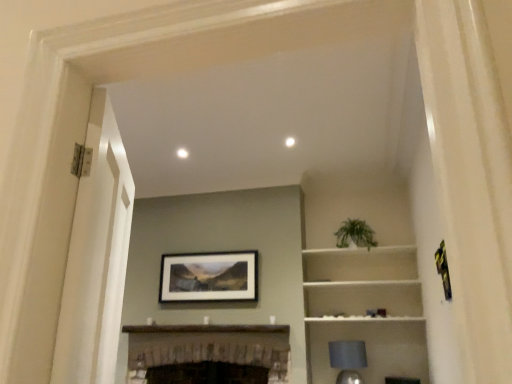
Question: Is white matte cabinet at upper right not within dark brown wood fireplace at center?

Choices:
 (A) yes
 (B) no

Answer: (A)

Question: Can you confirm if white matte cabinet at upper right is shorter than dark brown wood fireplace at center?

Choices:
 (A) no
 (B) yes

Answer: (A)

Question: From a real-world perspective, is white matte cabinet at upper right positioned under dark brown wood fireplace at center based on gravity?

Choices:
 (A) yes
 (B) no

Answer: (B)

Question: Is white matte cabinet at upper right taller than dark brown wood fireplace at center?

Choices:
 (A) no
 (B) yes

Answer: (B)

Question: Is there a large distance between white matte cabinet at upper right and dark brown wood fireplace at center?

Choices:
 (A) no
 (B) yes

Answer: (A)

Question: Considering the positions of white glossy door at left and matte black picture frame at center in the image, is white glossy door at left bigger or smaller than matte black picture frame at center?

Choices:
 (A) big
 (B) small

Answer: (A)

Question: From a real-world perspective, is white glossy door at left positioned above or below matte black picture frame at center?

Choices:
 (A) above
 (B) below

Answer: (B)

Question: Based on their positions, is white glossy door at left located to the left or right of matte black picture frame at center?

Choices:
 (A) left
 (B) right

Answer: (B)

Question: Considering the positions of white glossy door at left and matte black picture frame at center in the image, is white glossy door at left taller or shorter than matte black picture frame at center?

Choices:
 (A) short
 (B) tall

Answer: (B)

Question: Considering the positions of white matte cabinet at upper right and dark brown wood fireplace at center in the image, is white matte cabinet at upper right bigger or smaller than dark brown wood fireplace at center?

Choices:
 (A) big
 (B) small

Answer: (B)

Question: Is white matte cabinet at upper right situated inside dark brown wood fireplace at center or outside?

Choices:
 (A) inside
 (B) outside

Answer: (B)

Question: From a real-world perspective, is white matte cabinet at upper right physically located above or below dark brown wood fireplace at center?

Choices:
 (A) above
 (B) below

Answer: (A)

Question: In terms of width, does white matte cabinet at upper right look wider or thinner when compared to dark brown wood fireplace at center?

Choices:
 (A) thin
 (B) wide

Answer: (A)

Question: Which is correct: white matte cabinet at upper right is inside matte black picture frame at center, or outside of it?

Choices:
 (A) inside
 (B) outside

Answer: (B)

Question: Is white matte cabinet at upper right wider or thinner than matte black picture frame at center?

Choices:
 (A) wide
 (B) thin

Answer: (A)